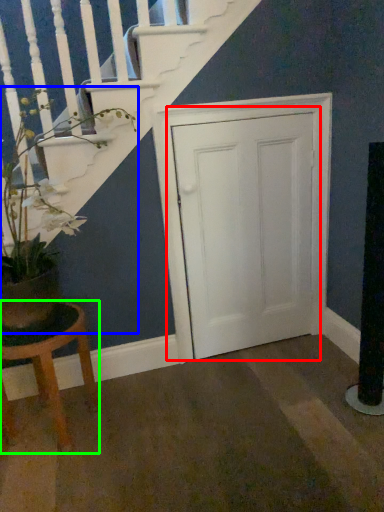
Question: Which is nearer to the door (highlighted by a red box)? houseplant (highlighted by a blue box) or stool (highlighted by a green box).

Choices:
 (A) houseplant
 (B) stool

Answer: (A)